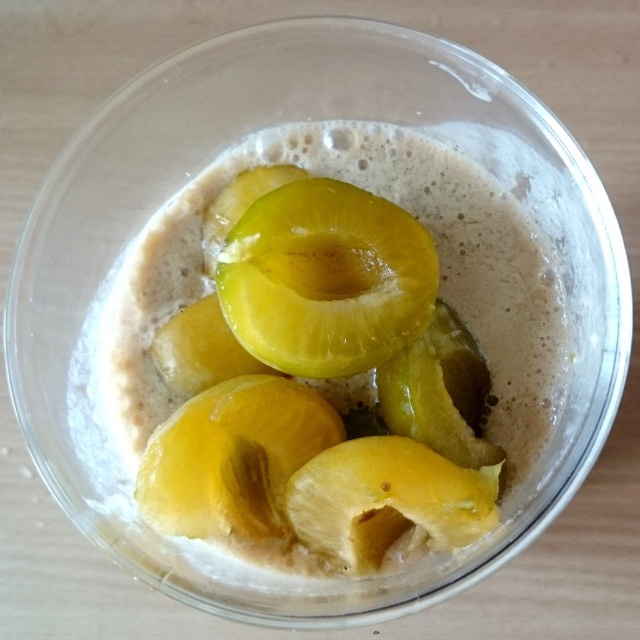
Based on the photo, you are arranging fruits in a bowl and see both the translucent yellow fruit at center and the yellow matte fruit at center. Which fruit is located to the left of the other?

The translucent yellow fruit at center is positioned on the left side of yellow matte fruit at center.

You are a chef preparing a fruit arrangement and have both the translucent yellow fruit at center and the yellow translucent plum at center in a glass bowl. Which fruit is taller when placed upright?

The translucent yellow fruit at center is taller than the yellow translucent plum at center when placed upright.